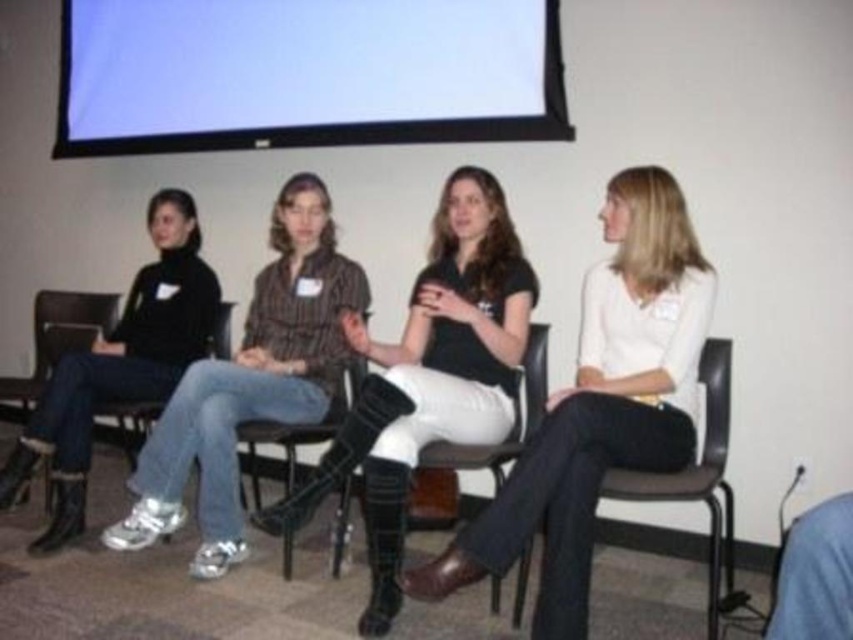
Question: Can you confirm if white matte projection screen at upper center is bigger than matte black shirt at center?

Choices:
 (A) yes
 (B) no

Answer: (A)

Question: Does matte black shirt at center have a smaller size compared to matte black boots at left?

Choices:
 (A) yes
 (B) no

Answer: (B)

Question: Which point is closer to the camera?

Choices:
 (A) matte black shirt at center
 (B) white matte projection screen at upper center
 (C) metallic silver chair at center

Answer: (A)

Question: In this image, where is white matte projection screen at upper center located relative to black leather boots at center?

Choices:
 (A) left
 (B) right

Answer: (A)

Question: Which object appears farthest from the camera in this image?

Choices:
 (A) black plastic chair at center
 (B) black leather boots at center
 (C) metallic silver chair at center
 (D) matte black boots at left

Answer: (D)

Question: Which point is closer to the camera?

Choices:
 (A) jeans at center
 (B) black leather boots at center
 (C) black plastic chair at center

Answer: (C)